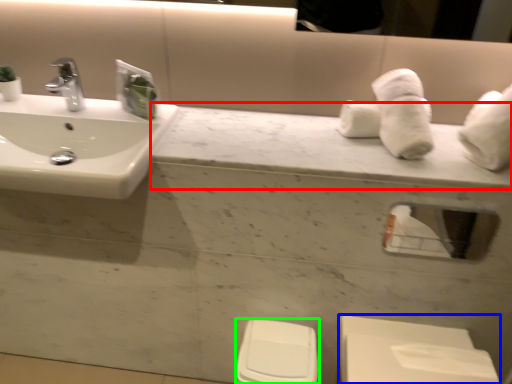
Question: Based on their relative distances, which object is farther from counter top (highlighted by a red box)? Choose from porcelain (highlighted by a blue box) and toilet bowl (highlighted by a green box).

Choices:
 (A) porcelain
 (B) toilet bowl

Answer: (B)